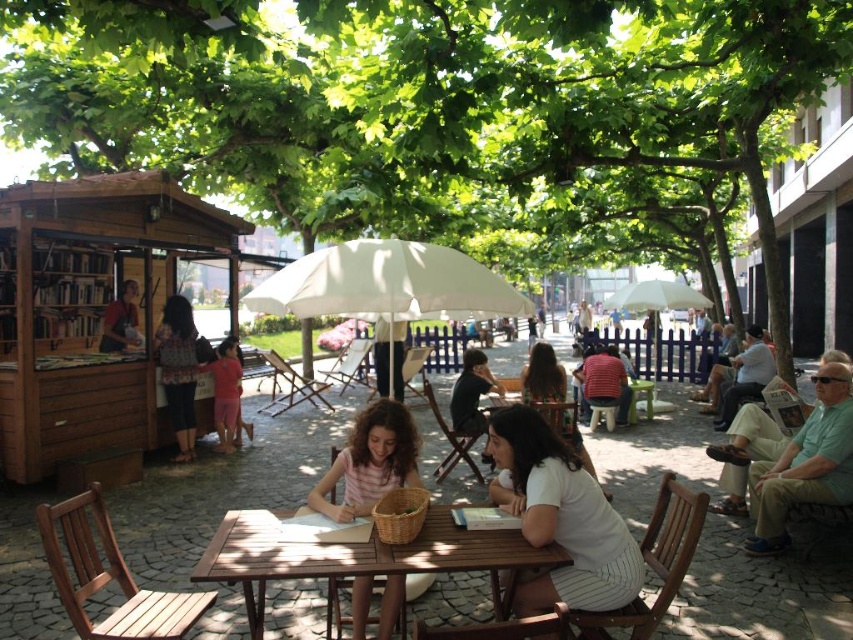
Question: Which point is farther from the camera taking this photo?

Choices:
 (A) (341, 516)
 (B) (165, 330)
 (C) (125, 337)

Answer: (C)

Question: Which point is closer to the camera?

Choices:
 (A) light brown hair at center
 (B) white cotton shirt at center
 (C) brown wooden table at center

Answer: (C)

Question: Does striped cotton shirt at center have a smaller size compared to white fabric umbrella at center?

Choices:
 (A) no
 (B) yes

Answer: (B)

Question: Is green leafy tree at center to the left of striped cotton shirt at center from the viewer's perspective?

Choices:
 (A) no
 (B) yes

Answer: (A)

Question: Which object is the closest to the patterned fabric blouse at left?

Choices:
 (A) striped cotton shirt at center
 (B) brown wooden table at center
 (C) pink fabric dress at center
 (D) light brown hair at center

Answer: (C)

Question: Can you confirm if green leafy tree at center is bigger than patterned fabric blouse at left?

Choices:
 (A) yes
 (B) no

Answer: (B)